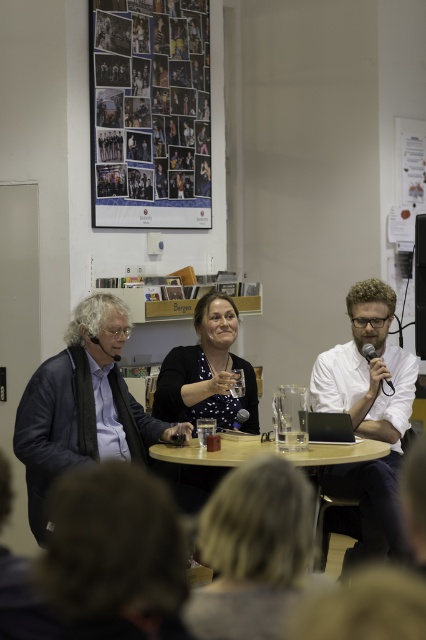
You are standing in the room and want to move from point A to point B. Point A is at coordinate point (118, 378) and point B is at coordinate point (313, 442). Which point is closer to you?

Point A at coordinate point (118, 378) is closer to you than point B at coordinate point (313, 442).

In the scene, there are a white matte shirt at center and a wooden table at center. Which object has a greater width?

The wooden table at center is wider than the white matte shirt at center.